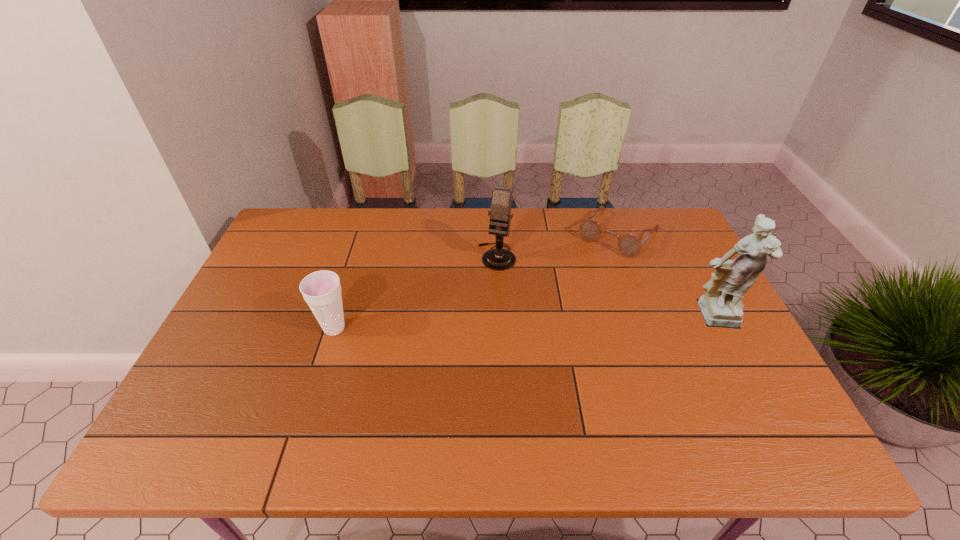
Locate an element on the screen. the leftmost object is located at coordinates (321, 290).

Where is `the second shortest object`? The image size is (960, 540). the second shortest object is located at coordinates (321, 290).

Identify the location of figurine. (721, 306).

The image size is (960, 540). I want to click on the third object from right to left, so click(499, 259).

The image size is (960, 540). What are the coordinates of `microphone` in the screenshot? It's located at (499, 259).

Where is `spectacles`? This screenshot has height=540, width=960. spectacles is located at coordinates (629, 245).

This screenshot has width=960, height=540. In order to click on vacant space located on the front of the leftmost object in this screenshot , I will do `click(322, 368)`.

Find the location of a particular element. This screenshot has width=960, height=540. free space located on the front-facing side of the figurine is located at coordinates (743, 375).

This screenshot has height=540, width=960. I want to click on free region located 0.330m on the front-facing side of the microphone, so click(x=461, y=355).

This screenshot has width=960, height=540. Find the location of `free space located 0.060m on the front-facing side of the microphone`. free space located 0.060m on the front-facing side of the microphone is located at coordinates (488, 284).